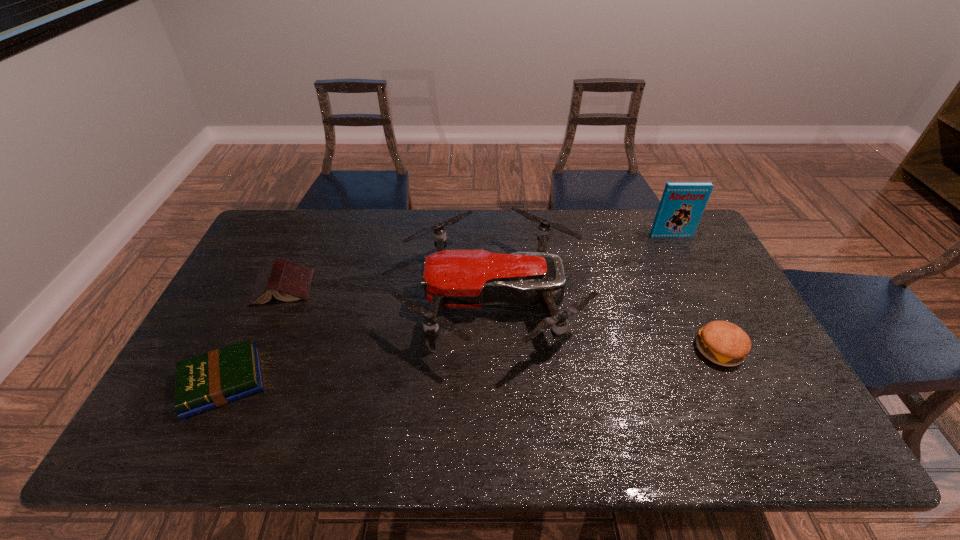
Identify the location of free space between the drone and the tallest object. (582, 267).

Where is `empty location between the nearest book and the drone`? The height and width of the screenshot is (540, 960). empty location between the nearest book and the drone is located at coordinates (358, 340).

At what (x,y) coordinates should I click in order to perform the action: click on vacant area that lies between the third tallest object and the fourth tallest object. Please return your answer as a coordinate pair (x, y). The width and height of the screenshot is (960, 540). Looking at the image, I should click on (501, 319).

The image size is (960, 540). I want to click on free spot between the third object from left to right and the shortest book, so click(x=358, y=340).

At what (x,y) coordinates should I click in order to perform the action: click on empty space that is in between the third tallest object and the second shortest book. Please return your answer as a coordinate pair (x, y). This screenshot has height=540, width=960. Looking at the image, I should click on (501, 319).

Image resolution: width=960 pixels, height=540 pixels. What are the coordinates of `free space between the farthest book and the third object from right to left` in the screenshot? It's located at (582, 267).

Find the location of a particular element. This screenshot has width=960, height=540. unoccupied position between the shortest book and the farthest book is located at coordinates (446, 309).

Identify which object is located as the third nearest to the farthest book. Please provide its 2D coordinates. Your answer should be formatted as a tuple, i.e. [(x, y)], where the tuple contains the x and y coordinates of a point satisfying the conditions above.

[(287, 281)]

Select which object is the third closest to the fourth shortest object. Please provide its 2D coordinates. Your answer should be formatted as a tuple, i.e. [(x, y)], where the tuple contains the x and y coordinates of a point satisfying the conditions above.

[(682, 204)]

Point out which book is positioned as the nearest to the shortest book. Please provide its 2D coordinates. Your answer should be formatted as a tuple, i.e. [(x, y)], where the tuple contains the x and y coordinates of a point satisfying the conditions above.

[(287, 281)]